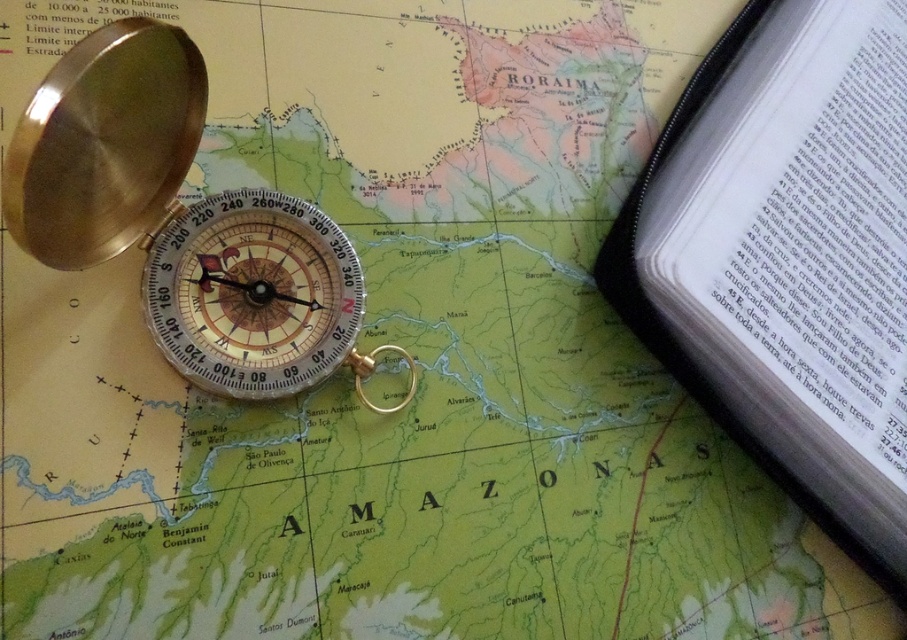
How distant is white paper book at lower right from gold polished compass at upper left?

A distance of 24.44 inches exists between white paper book at lower right and gold polished compass at upper left.

Is the position of white paper book at lower right more distant than that of gold polished compass at upper left?

Yes, white paper book at lower right is further from the viewer.

Does point (718, 145) come farther from viewer compared to point (332, 285)?

Yes, point (718, 145) is farther from viewer.

I want to click on white paper book at lower right, so click(787, 259).